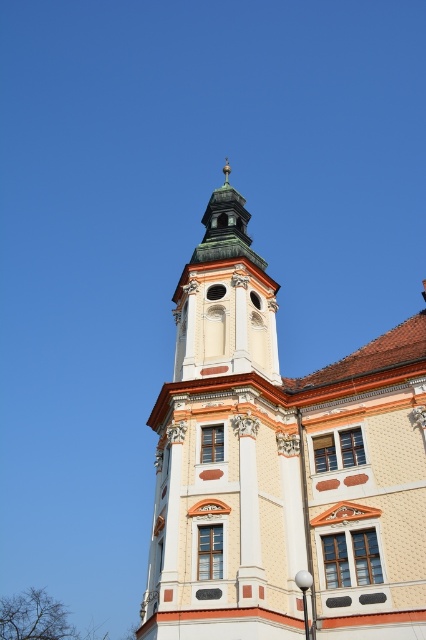
Can you confirm if white stone tower at center is taller than green copper bell tower at upper center?

Indeed, white stone tower at center has a greater height compared to green copper bell tower at upper center.

Who is lower down, white stone tower at center or green copper bell tower at upper center?

green copper bell tower at upper center

Which is behind, point (376, 611) or point (268, 344)?

The point (268, 344) is behind.

Image resolution: width=426 pixels, height=640 pixels. In order to click on white stone tower at center in this screenshot , I will do `click(282, 467)`.